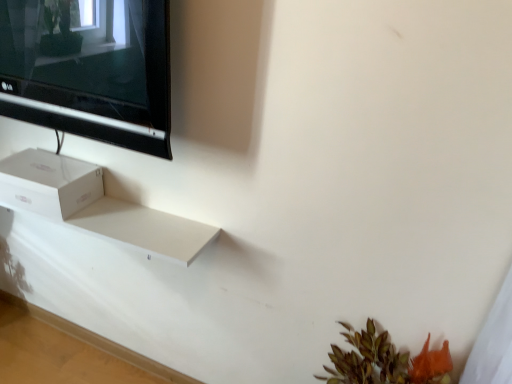
Locate an element on the screen. blank space situated above white cardboard box at lower left (from a real-world perspective) is located at coordinates (51, 167).